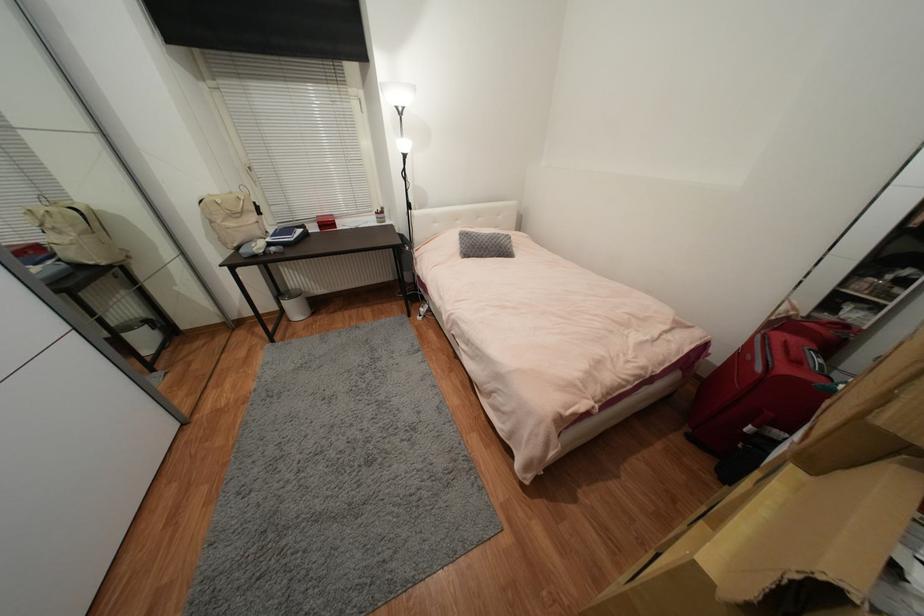
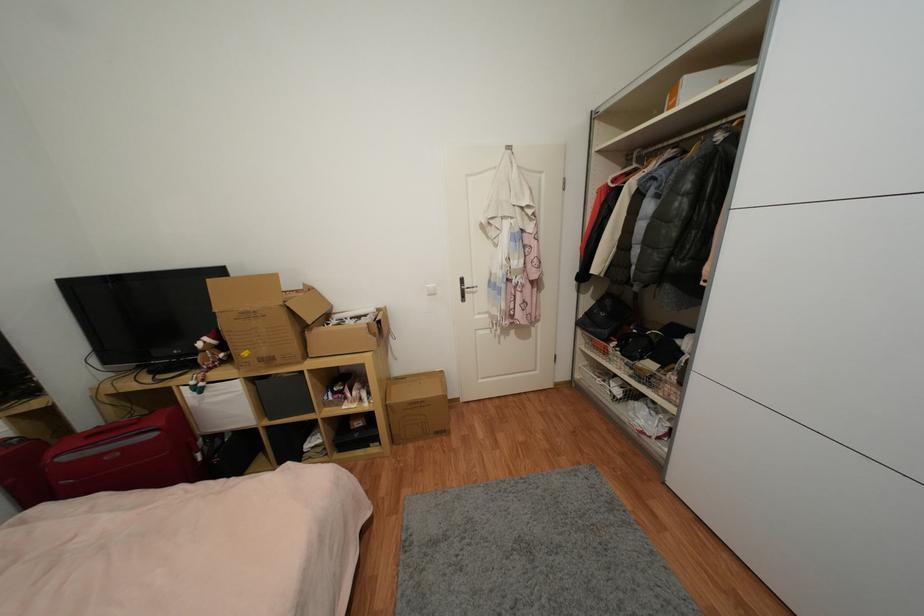
Locate, in the second image, the point that corresponds to (763,371) in the first image.

(157, 436)